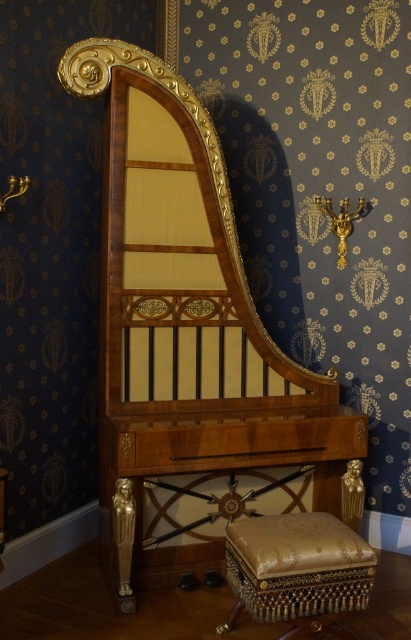
Can you confirm if walnut wood harpsichord at center is positioned to the right of gold textured cushion at lower center?

Incorrect, walnut wood harpsichord at center is not on the right side of gold textured cushion at lower center.

Who is higher up, walnut wood harpsichord at center or gold textured cushion at lower center?

Positioned higher is walnut wood harpsichord at center.

Is point (143, 508) closer to viewer compared to point (251, 573)?

No, (143, 508) is further to viewer.

The image size is (411, 640). What are the coordinates of `walnut wood harpsichord at center` in the screenshot? It's located at (205, 365).